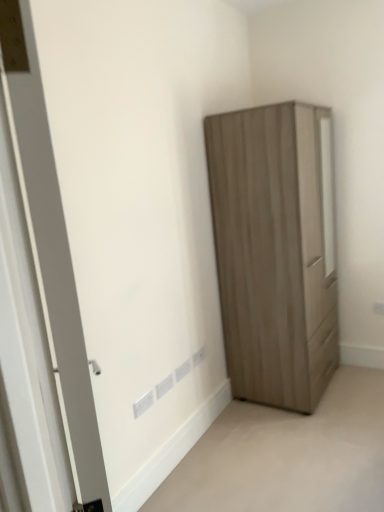
Question: Choose the correct answer: Is matte wood wardrobe at lower right inside white plastic electric outlet at lower center or outside it?

Choices:
 (A) outside
 (B) inside

Answer: (A)

Question: Is point (382, 407) closer or farther from the camera than point (145, 394)?

Choices:
 (A) closer
 (B) farther

Answer: (B)

Question: Considering the real-world distances, which object is closest to the white matte door at left?

Choices:
 (A) matte wood wardrobe at right
 (B) white plastic electric outlet at lower center
 (C) matte wood wardrobe at lower right

Answer: (B)

Question: Estimate the real-world distances between objects in this image. Which object is closer to the white matte door at left?

Choices:
 (A) matte wood wardrobe at right
 (B) matte wood wardrobe at lower right
 (C) white plastic electric outlet at lower center

Answer: (C)